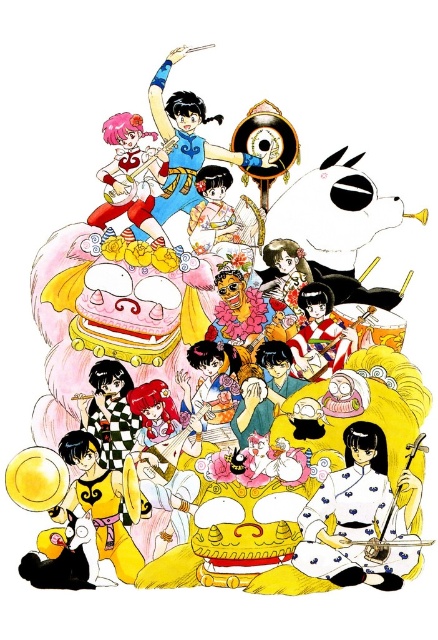
Question: Which point appears closest to the camera in this image?

Choices:
 (A) (311, 296)
 (B) (119, 417)
 (C) (194, 115)

Answer: (B)

Question: Is blue silk kimono at upper center to the right of matte white kimono at center from the viewer's perspective?

Choices:
 (A) no
 (B) yes

Answer: (A)

Question: Which point is farther from the camera taking this photo?

Choices:
 (A) (116, 381)
 (B) (207, 369)
 (C) (349, 532)

Answer: (A)

Question: Is blue silk kimono at upper center below checkered fabric kimono at center?

Choices:
 (A) no
 (B) yes

Answer: (A)

Question: Can you confirm if matte yellow kimono at lower left is positioned above matte white kimono at center?

Choices:
 (A) yes
 (B) no

Answer: (B)

Question: Which of the following is the closest to the observer?

Choices:
 (A) white matte kimono at center
 (B) matte white dress at upper left
 (C) matte white kimono at center

Answer: (A)